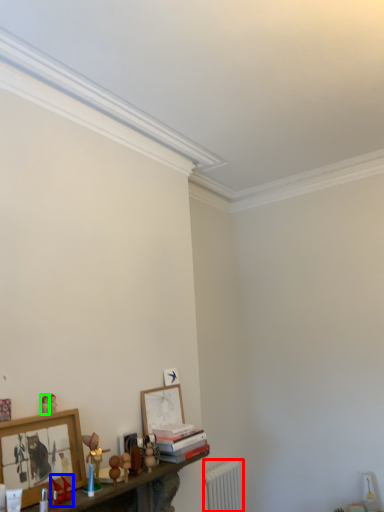
Question: Which object is the closest to the radiator (highlighted by a red box)? Choose among these: toy (highlighted by a blue box) or toy (highlighted by a green box).

Choices:
 (A) toy
 (B) toy

Answer: (A)